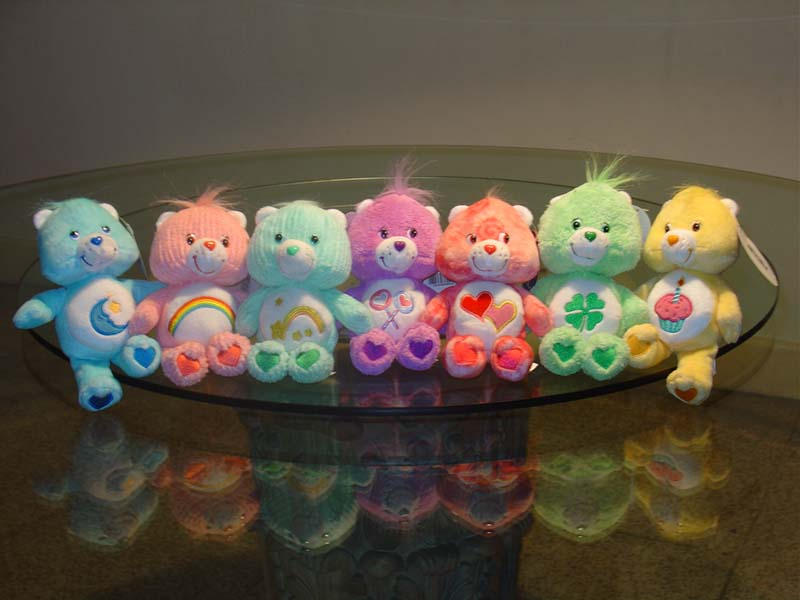
You are a GUI agent. You are given a task and a screenshot of the screen. Output one action in this format:
    pyautogui.click(x=<x>, y=<y>)
    Task: Click on the rainbow decoration
    The width and height of the screenshot is (800, 600).
    Given the screenshot: What is the action you would take?
    pyautogui.click(x=202, y=303)